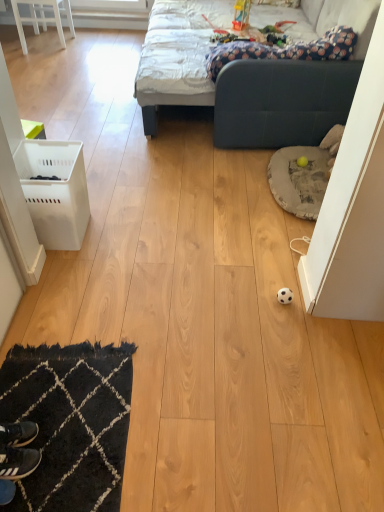
At what (x,y) coordinates should I click in order to perform the action: click on free spot to the right of white glossy chair at upper left. Please return your answer as a coordinate pair (x, y). Looking at the image, I should click on (100, 42).